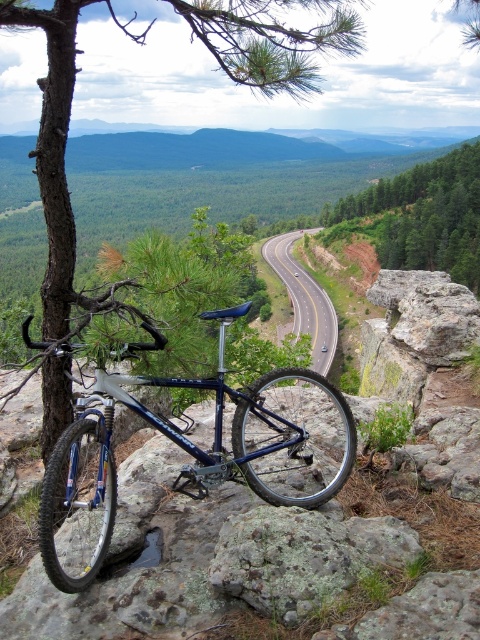
Question: Is brown rough tree at upper left above green leafy tree at center?

Choices:
 (A) yes
 (B) no

Answer: (A)

Question: Which object appears farthest from the camera in this image?

Choices:
 (A) brown rough tree at upper left
 (B) green mossy rock at center
 (C) asphalt road at center

Answer: (C)

Question: Which of the following is the closest to the observer?

Choices:
 (A) (478, 150)
 (B) (271, 83)
 (C) (336, 333)
 (D) (168, 436)

Answer: (D)

Question: Can you confirm if brown rough tree at upper left is smaller than green mossy rock at center?

Choices:
 (A) yes
 (B) no

Answer: (B)

Question: Which object appears farthest from the camera in this image?

Choices:
 (A) green mossy rock at center
 (B) green leafy tree at center
 (C) brown rough tree at upper left

Answer: (B)

Question: Considering the relative positions of shiny blue frame at center and brown rough tree at upper left in the image provided, where is shiny blue frame at center located with respect to brown rough tree at upper left?

Choices:
 (A) above
 (B) below

Answer: (B)